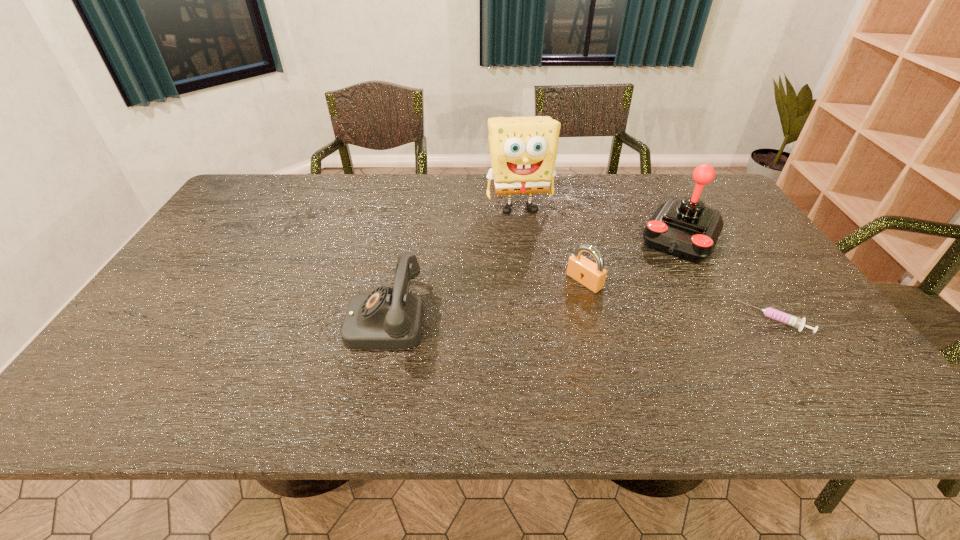
What are the coordinates of `joystick located at the far edge` in the screenshot? It's located at (686, 228).

Locate an element on the screen. The width and height of the screenshot is (960, 540). object that is at the near edge is located at coordinates (388, 318).

Identify the location of syringe that is positioned at the right edge. (769, 312).

Identify the location of joystick present at the right edge. The width and height of the screenshot is (960, 540). (686, 228).

Locate an element on the screen. object at the far right corner is located at coordinates (686, 228).

Find the location of `free space at the far edge of the desktop`. free space at the far edge of the desktop is located at coordinates (353, 186).

Where is `vacant space at the near edge of the desktop`? vacant space at the near edge of the desktop is located at coordinates (657, 352).

Where is `vacant area at the left edge`? This screenshot has height=540, width=960. vacant area at the left edge is located at coordinates (192, 294).

Identify the location of free spot at the far left corner of the desktop. (276, 199).

Find the location of a particular element. The image size is (960, 540). free spot at the far right corner of the desktop is located at coordinates (689, 174).